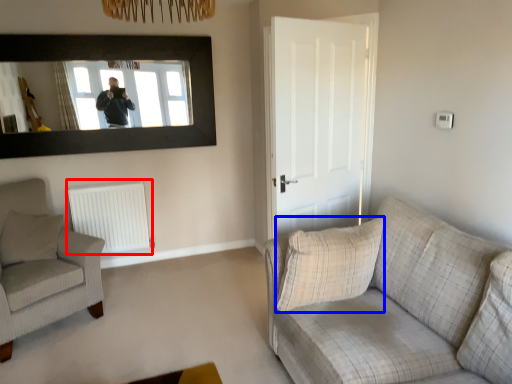
Question: Among these objects, which one is farthest to the camera, radiator (highlighted by a red box) or pillow (highlighted by a blue box)?

Choices:
 (A) radiator
 (B) pillow

Answer: (A)